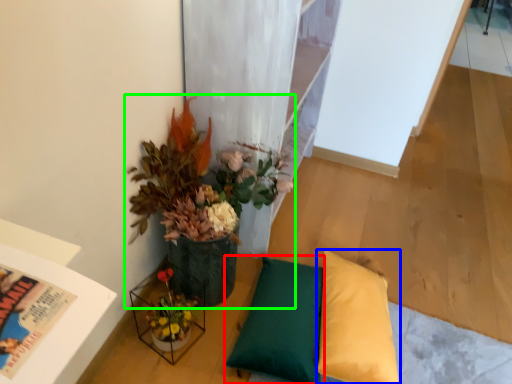
Question: Which is nearer to the pillow (highlighted by a red box)? pillow (highlighted by a blue box) or houseplant (highlighted by a green box).

Choices:
 (A) pillow
 (B) houseplant

Answer: (A)